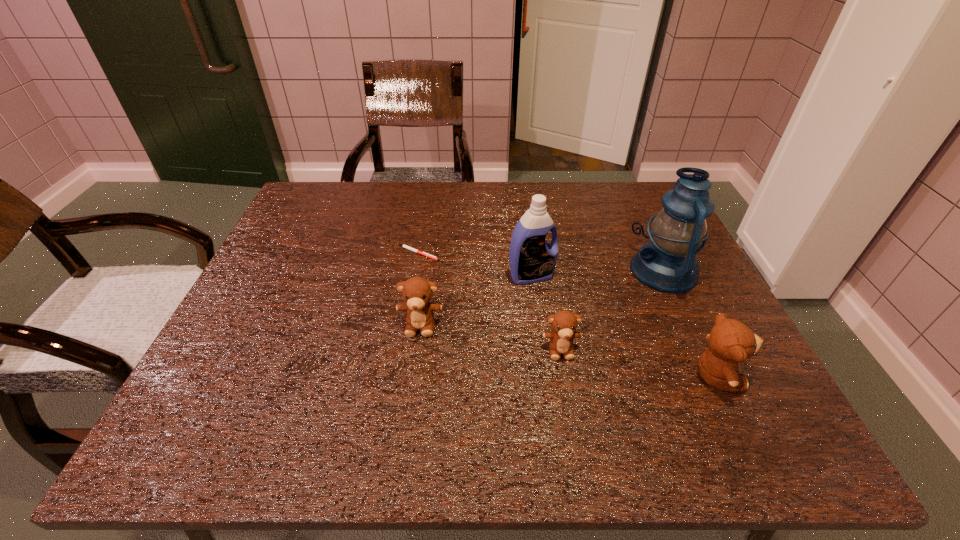
In the image, there is a desktop. Where is `vacant space at the far edge`? This screenshot has width=960, height=540. vacant space at the far edge is located at coordinates (481, 205).

Find the location of a particular element. The image size is (960, 540). vacant space at the near edge of the desktop is located at coordinates (544, 388).

In the image, there is a desktop. At what (x,y) coordinates should I click in order to perform the action: click on free space at the right edge. Please return your answer as a coordinate pair (x, y). This screenshot has width=960, height=540. Looking at the image, I should click on (690, 319).

You are a GUI agent. You are given a task and a screenshot of the screen. Output one action in this format:
    pyautogui.click(x=<x>, y=<y>)
    Task: Click on the vacant space at the near left corner of the desktop
    The width and height of the screenshot is (960, 540).
    Given the screenshot: What is the action you would take?
    pyautogui.click(x=255, y=401)

In the image, there is a desktop. Identify the location of free space at the far right corner. This screenshot has width=960, height=540. (614, 184).

This screenshot has height=540, width=960. In the image, there is a desktop. In order to click on free space at the near right corner in this screenshot , I will do `click(685, 366)`.

You are a GUI agent. You are given a task and a screenshot of the screen. Output one action in this format:
    pyautogui.click(x=<x>, y=<y>)
    Task: Click on the vacant space in between the pen and the fifth shortest object
    This screenshot has height=540, width=960.
    Given the screenshot: What is the action you would take?
    pyautogui.click(x=475, y=265)

This screenshot has height=540, width=960. I want to click on free spot between the lantern and the detergent, so click(598, 273).

Where is `free space between the fifth shortest object and the fifth tallest object`? free space between the fifth shortest object and the fifth tallest object is located at coordinates (546, 312).

The width and height of the screenshot is (960, 540). Find the location of `vacant space that is in between the tallest object and the rightmost teddy bear`. vacant space that is in between the tallest object and the rightmost teddy bear is located at coordinates (690, 323).